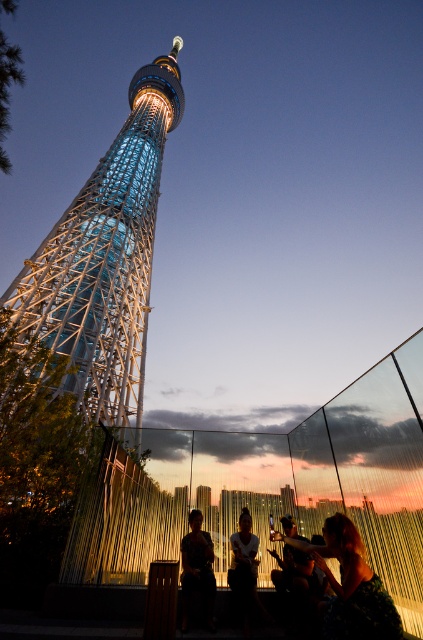
Question: Which object is positioned closest to the dark brown hair at center?

Choices:
 (A) silhouette fabric at center
 (B) shiny metallic tower at center
 (C) silhouette fabric at lower center

Answer: (A)

Question: Can you confirm if shiny metallic tower at center is positioned to the right of silhouette fabric at center?

Choices:
 (A) yes
 (B) no

Answer: (B)

Question: Which object is farther from the camera taking this photo?

Choices:
 (A) silhouette fabric at center
 (B) dark brown hair at center
 (C) silhouette fabric at lower center
 (D) shiny metallic tower at center

Answer: (D)

Question: Is shiny metallic tower at center bigger than silhouette fabric at lower center?

Choices:
 (A) no
 (B) yes

Answer: (B)

Question: Which point is farther from the camera taking this photo?

Choices:
 (A) pyautogui.click(x=120, y=186)
 (B) pyautogui.click(x=194, y=557)

Answer: (A)

Question: Is shiny metallic tower at center behind dark brown hair at center?

Choices:
 (A) yes
 (B) no

Answer: (A)